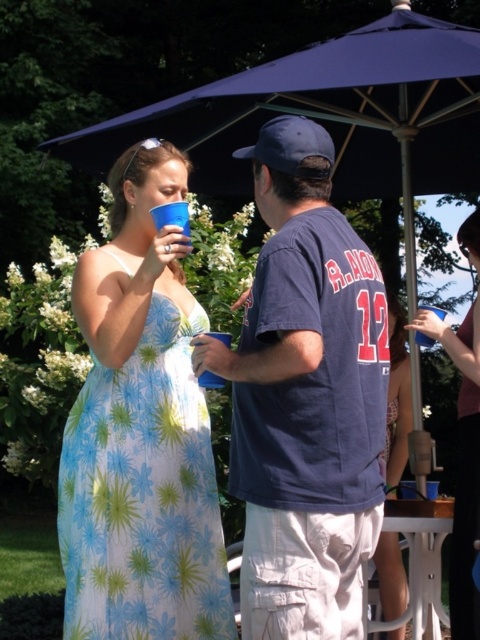
You are planning to use the blue fabric umbrella at upper center to cover the blue plastic cup at center from the sun. Is the umbrella large enough to fully cover the cup?

The blue fabric umbrella at upper center is bigger than the blue plastic cup at center, so yes, it can fully cover the cup.